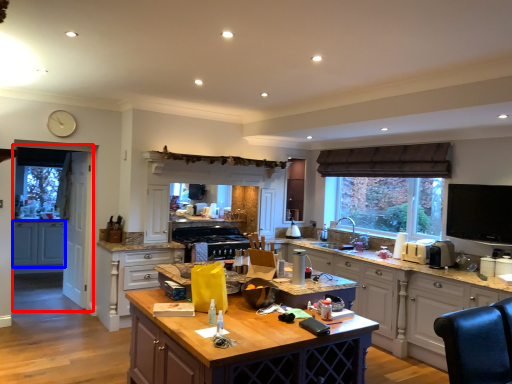
Question: Which object appears farthest to the camera in this image, screen door (highlighted by a red box) or cabinetry (highlighted by a blue box)?

Choices:
 (A) screen door
 (B) cabinetry

Answer: (B)